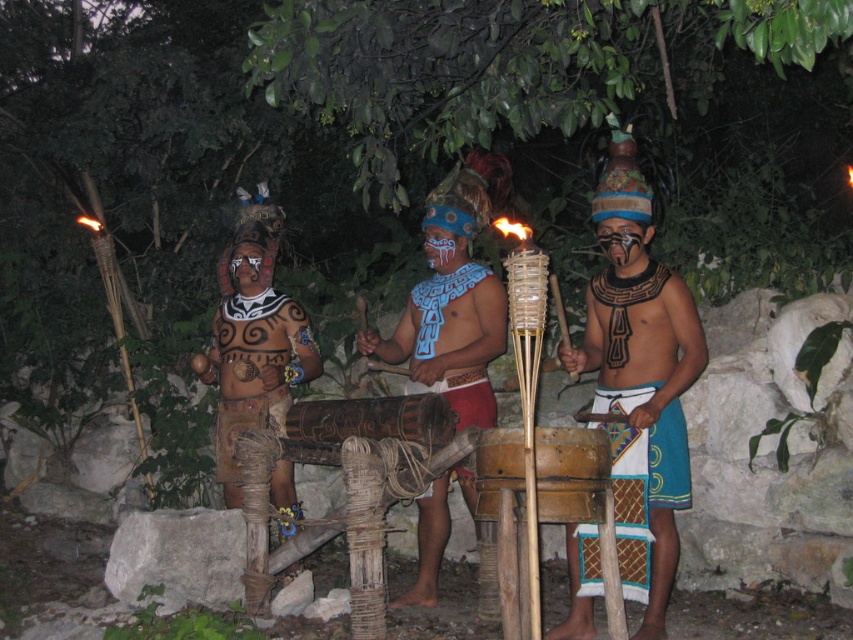
Question: Which point appears closest to the camera in this image?

Choices:
 (A) (608, 458)
 (B) (241, 288)
 (C) (262, 310)
 (D) (433, 339)

Answer: (A)

Question: Is blue painted wood drum at center to the right of matte brown wood drum at center from the viewer's perspective?

Choices:
 (A) no
 (B) yes

Answer: (B)

Question: Which of these objects is positioned closest to the wooden drum at center?

Choices:
 (A) blue painted wood drum at center
 (B) matte blue fabric at center
 (C) matte black face at center

Answer: (B)

Question: Is matte brown wood drum at center to the right of wooden drum at center from the viewer's perspective?

Choices:
 (A) yes
 (B) no

Answer: (B)

Question: Is blue painted wood drum at center above matte black face at center?

Choices:
 (A) yes
 (B) no

Answer: (B)

Question: Among these objects, which one is nearest to the camera?

Choices:
 (A) matte black face paint at center
 (B) matte blue fabric at center
 (C) wooden drum at center

Answer: (C)